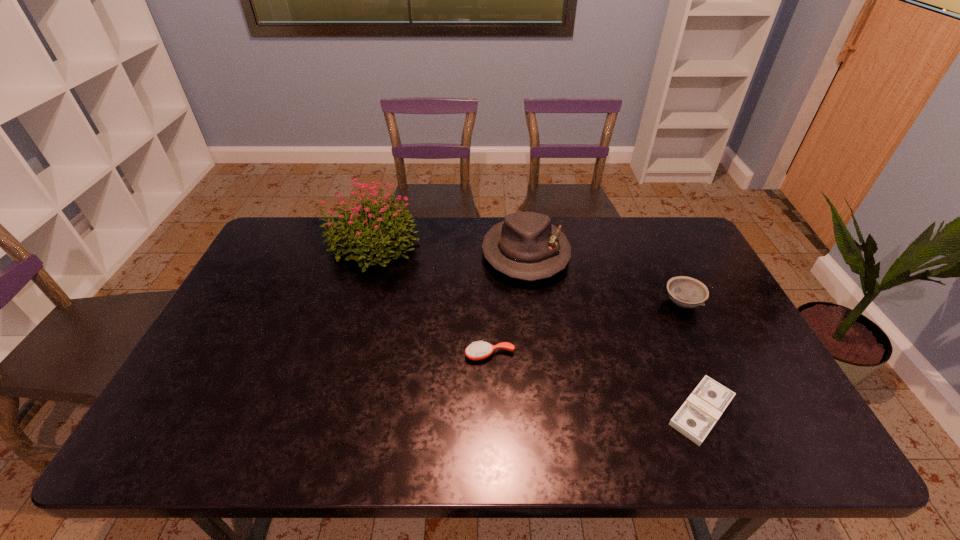
The image size is (960, 540). I want to click on empty space that is in between the hairbrush and the third shortest object, so click(x=586, y=329).

Identify the location of free point between the third shortest object and the dollar. (691, 357).

Locate an element on the screen. vacant region between the nearest object and the hat is located at coordinates (613, 332).

Where is `vacant area that lies between the leftmost object and the fourth tallest object`? vacant area that lies between the leftmost object and the fourth tallest object is located at coordinates (431, 300).

Identify which object is the third closest to the tallest object. Please provide its 2D coordinates. Your answer should be formatted as a tuple, i.e. [(x, y)], where the tuple contains the x and y coordinates of a point satisfying the conditions above.

[(686, 292)]

Find the location of a particular element. The height and width of the screenshot is (540, 960). the fourth closest object to the third farthest object is located at coordinates (373, 227).

Locate an element on the screen. Image resolution: width=960 pixels, height=540 pixels. free space that satisfies the following two spatial constraints: 1. on the decorative side of the dollar; 2. on the right side of the fourth shortest object is located at coordinates (544, 411).

You are a GUI agent. You are given a task and a screenshot of the screen. Output one action in this format:
    pyautogui.click(x=<x>, y=<y>)
    Task: Click on the free space that satisfies the following two spatial constraints: 1. on the decorative side of the nearest object; 2. on the left side of the fourth shortest object
    
    Given the screenshot: What is the action you would take?
    pyautogui.click(x=544, y=411)

At what (x,y) coordinates should I click in order to perform the action: click on vacant space that satisfies the following two spatial constraints: 1. on the decorative side of the third shortest object; 2. on the left side of the second tallest object. Please return your answer as a coordinate pair (x, y). Looking at the image, I should click on (532, 303).

Find the location of a particular element. This screenshot has height=540, width=960. vacant region that satisfies the following two spatial constraints: 1. on the back side of the bowl; 2. on the left side of the shortest object is located at coordinates (657, 303).